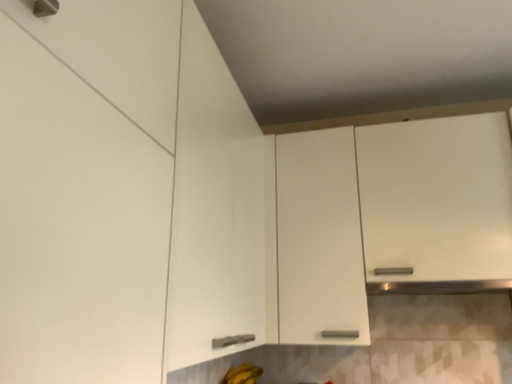
Question: Could you tell me if white matte cabinet at upper right, placed as the 1th cabinetry when sorted from right to left, is turned towards white matte cabinet at lower left, the 1th cabinetry when ordered from left to right?

Choices:
 (A) yes
 (B) no

Answer: (A)

Question: Considering the relative sizes of white matte cabinet at upper right, acting as the 2th cabinetry starting from the left, and white matte cabinet at lower left, the second cabinetry in the right-to-left sequence, in the image provided, is white matte cabinet at upper right, acting as the 2th cabinetry starting from the left, smaller than white matte cabinet at lower left, the second cabinetry in the right-to-left sequence,?

Choices:
 (A) no
 (B) yes

Answer: (A)

Question: Is the position of white matte cabinet at upper right, acting as the 2th cabinetry starting from the left, more distant than that of white matte cabinet at lower left, the 1th cabinetry when ordered from left to right?

Choices:
 (A) no
 (B) yes

Answer: (B)

Question: Can you see white matte cabinet at upper right, placed as the 1th cabinetry when sorted from right to left, touching white matte cabinet at lower left, the 1th cabinetry when ordered from left to right?

Choices:
 (A) yes
 (B) no

Answer: (B)

Question: Is white matte cabinet at upper right, acting as the 2th cabinetry starting from the left, at the left side of white matte cabinet at lower left, the second cabinetry in the right-to-left sequence?

Choices:
 (A) yes
 (B) no

Answer: (B)

Question: Does white matte cabinet at upper right, placed as the 1th cabinetry when sorted from right to left, contain white matte cabinet at lower left, the second cabinetry in the right-to-left sequence?

Choices:
 (A) yes
 (B) no

Answer: (B)

Question: From a real-world perspective, is white matte cabinet at lower left, the 1th cabinetry when ordered from left to right, positioned under white matte cabinet at upper right, placed as the 1th cabinetry when sorted from right to left, based on gravity?

Choices:
 (A) yes
 (B) no

Answer: (A)

Question: Does white matte cabinet at lower left, the second cabinetry in the right-to-left sequence, have a larger size compared to white matte cabinet at upper right, placed as the 1th cabinetry when sorted from right to left?

Choices:
 (A) no
 (B) yes

Answer: (A)

Question: Would you consider white matte cabinet at lower left, the second cabinetry in the right-to-left sequence, to be distant from white matte cabinet at upper right, acting as the 2th cabinetry starting from the left?

Choices:
 (A) no
 (B) yes

Answer: (B)

Question: From a real-world perspective, is white matte cabinet at lower left, the 1th cabinetry when ordered from left to right, physically above white matte cabinet at upper right, placed as the 1th cabinetry when sorted from right to left?

Choices:
 (A) no
 (B) yes

Answer: (A)

Question: From the image's perspective, does white matte cabinet at lower left, the 1th cabinetry when ordered from left to right, appear higher than white matte cabinet at upper right, acting as the 2th cabinetry starting from the left?

Choices:
 (A) no
 (B) yes

Answer: (B)

Question: Can you confirm if white matte cabinet at lower left, the second cabinetry in the right-to-left sequence, is taller than white matte cabinet at upper right, acting as the 2th cabinetry starting from the left?

Choices:
 (A) yes
 (B) no

Answer: (B)

Question: From the image's perspective, is white matte cabinet at upper right, acting as the 2th cabinetry starting from the left, over yellow matte bananas at lower center?

Choices:
 (A) yes
 (B) no

Answer: (A)